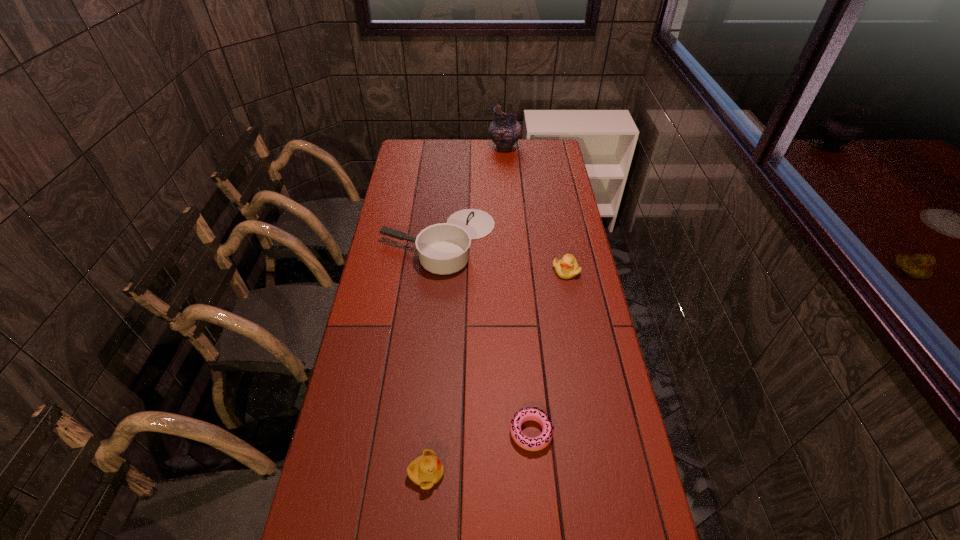
The image size is (960, 540). Identify the location of the tallest object. (505, 130).

Locate an element on the screen. The image size is (960, 540). the farthest object is located at coordinates (505, 130).

At what (x,y) coordinates should I click in order to perform the action: click on saucepan. Please return your answer as a coordinate pair (x, y). The image size is (960, 540). Looking at the image, I should click on (444, 248).

I want to click on the farther duckling, so click(x=567, y=267).

The width and height of the screenshot is (960, 540). I want to click on the right duckling, so click(x=567, y=267).

This screenshot has width=960, height=540. I want to click on the nearest object, so click(426, 470).

The image size is (960, 540). I want to click on the nearer duckling, so click(x=426, y=470).

Identify the location of the shortest object. (540, 442).

Image resolution: width=960 pixels, height=540 pixels. What are the coordinates of `doughnut` in the screenshot? It's located at (540, 442).

Where is `blank area located 0.210m on the left of the farthest object`? This screenshot has width=960, height=540. blank area located 0.210m on the left of the farthest object is located at coordinates pos(447,147).